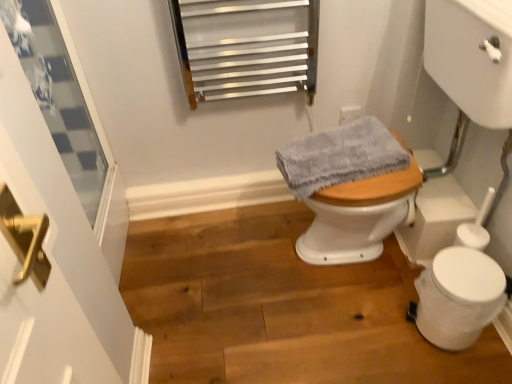
At what (x,y) coordinates should I click in order to perform the action: click on vacant region to the left of white glossy sink at right. Please return your answer as a coordinate pair (x, y). Looking at the image, I should click on (247, 274).